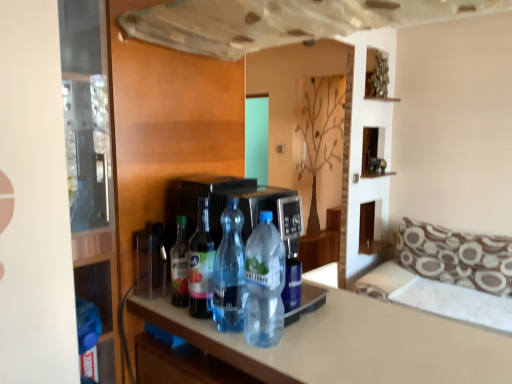
The width and height of the screenshot is (512, 384). In order to click on vacant area that is in front of clear plastic bottle at center, acting as the fourth bottle starting from the left in this screenshot , I will do `click(280, 362)`.